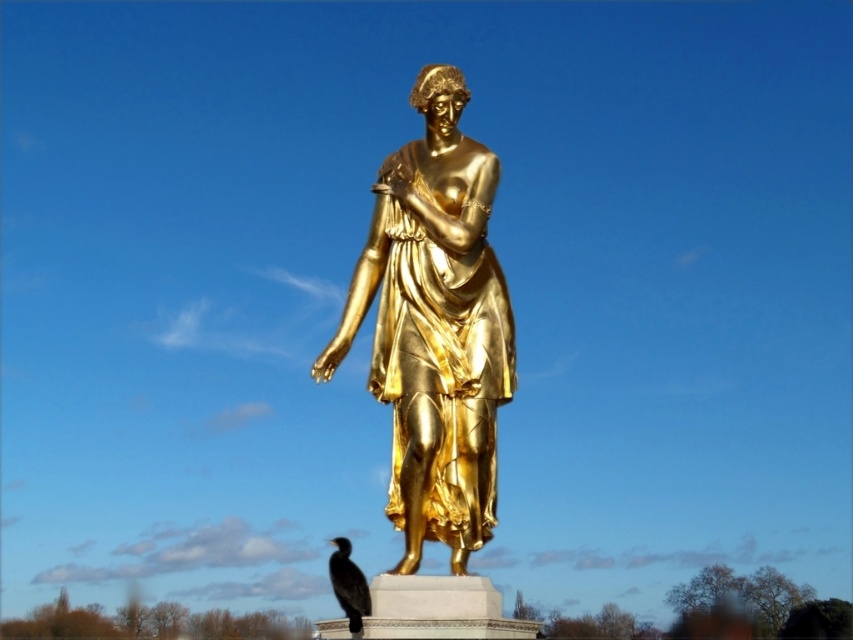
Does point (401, 358) lie behind point (355, 577)?

Yes, it is.

Where is `gold polished statue at center`? gold polished statue at center is located at coordinates (434, 326).